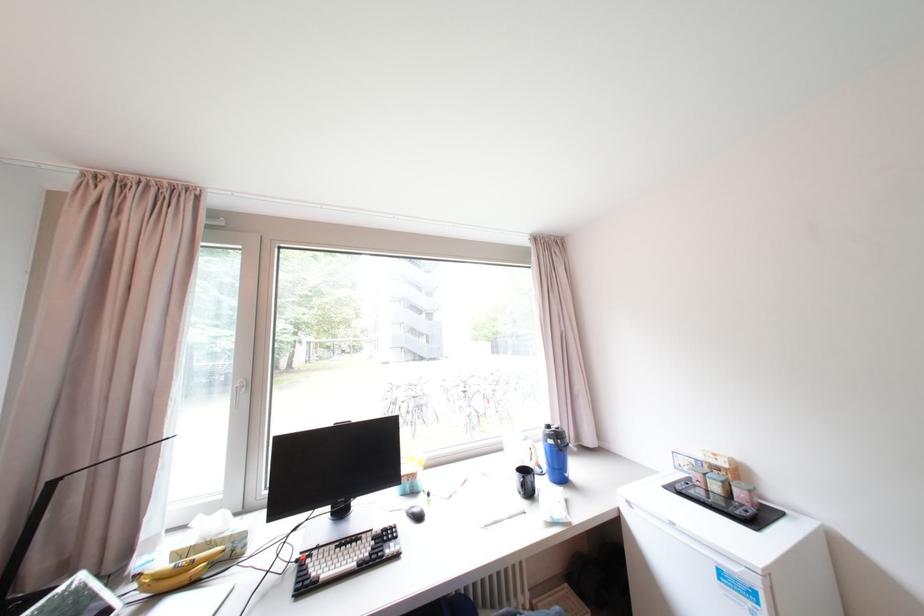
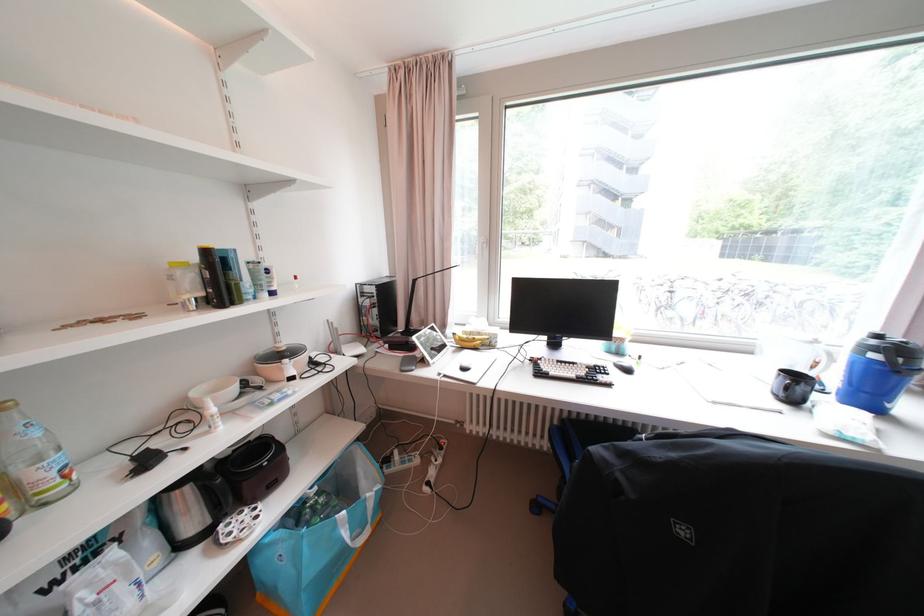
Question: I am providing you with two images of the same scene from different viewpoints. Please identify which objects are invisible in image2.

Choices:
 (A) black mouse
 (B) black pot handle
 (C) blue shaker handle
 (D) none of these

Answer: (D)